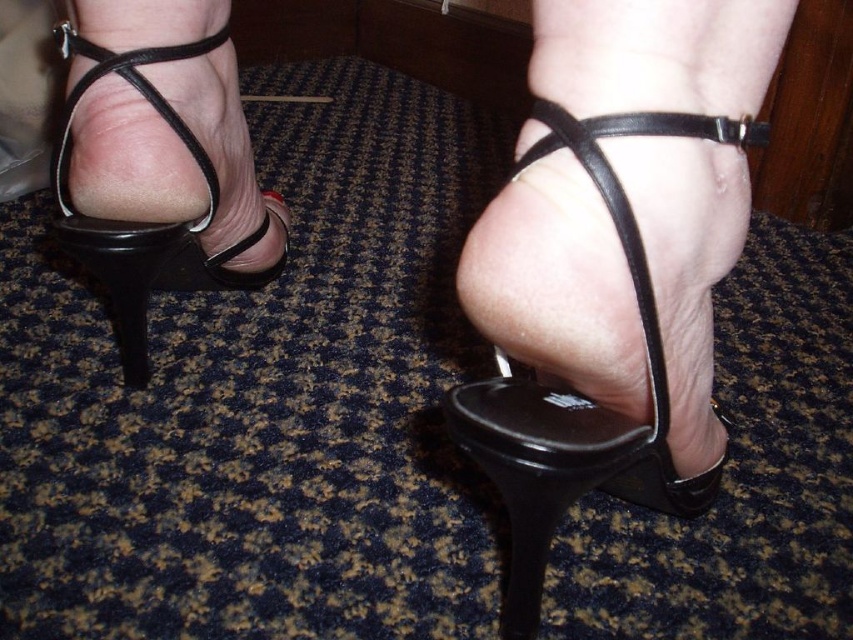
Question: Which point is farther to the camera?

Choices:
 (A) (149, 228)
 (B) (625, 486)

Answer: (A)

Question: Is matte black sandal at center thinner than black leather sandal at left?

Choices:
 (A) no
 (B) yes

Answer: (A)

Question: Is matte black sandal at center smaller than black leather sandal at left?

Choices:
 (A) yes
 (B) no

Answer: (A)

Question: Is matte black sandal at center below black leather sandal at left?

Choices:
 (A) no
 (B) yes

Answer: (B)

Question: Which object is closer to the camera taking this photo?

Choices:
 (A) matte black sandal at center
 (B) black leather sandal at left

Answer: (A)

Question: Which of the following is the farthest from the observer?

Choices:
 (A) matte black sandal at center
 (B) black leather sandal at left

Answer: (B)